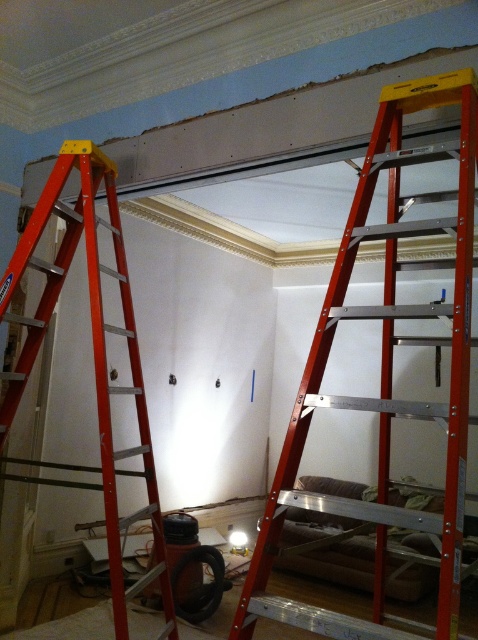
Question: Does metallic red ladder at center have a greater width compared to metallic orange ladder at left?

Choices:
 (A) yes
 (B) no

Answer: (B)

Question: Which point is farther from the camera taking this photo?

Choices:
 (A) (39, 314)
 (B) (299, 406)

Answer: (A)

Question: Does metallic red ladder at center appear on the right side of metallic orange ladder at left?

Choices:
 (A) yes
 (B) no

Answer: (A)

Question: Which point is closer to the camera?

Choices:
 (A) (93, 260)
 (B) (467, 104)

Answer: (B)

Question: Can you confirm if metallic red ladder at center is smaller than metallic orange ladder at left?

Choices:
 (A) no
 (B) yes

Answer: (A)